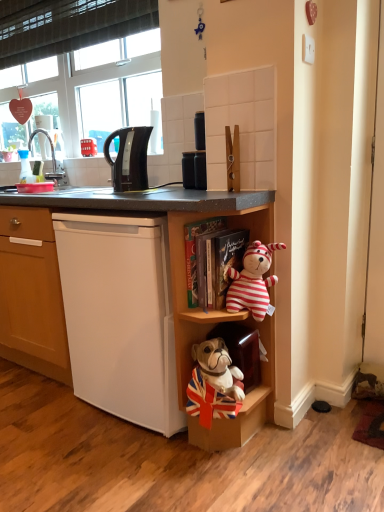
Where is `free space to the right of wooden shelf at lower right, marked as the first shelf in a bottom-to-top arrangement`? The height and width of the screenshot is (512, 384). free space to the right of wooden shelf at lower right, marked as the first shelf in a bottom-to-top arrangement is located at coordinates (311, 442).